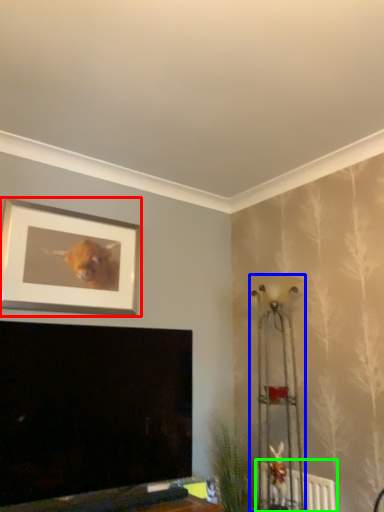
Question: Which object is the farthest from picture frame (highlighted by a red box)? Choose among these: lamp (highlighted by a blue box) or radiator (highlighted by a green box).

Choices:
 (A) lamp
 (B) radiator

Answer: (B)